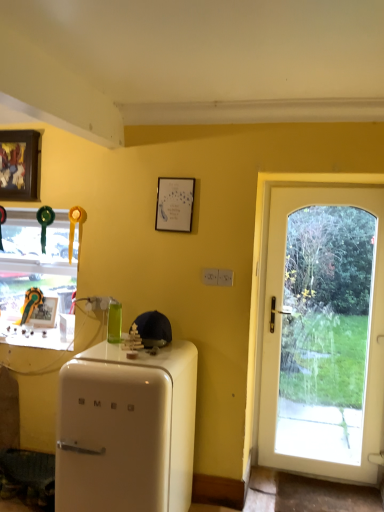
Where is `vacant region in front of matte black picture frame at left, the 1th picture frame in the left-to-right sequence`? The width and height of the screenshot is (384, 512). vacant region in front of matte black picture frame at left, the 1th picture frame in the left-to-right sequence is located at coordinates (30, 332).